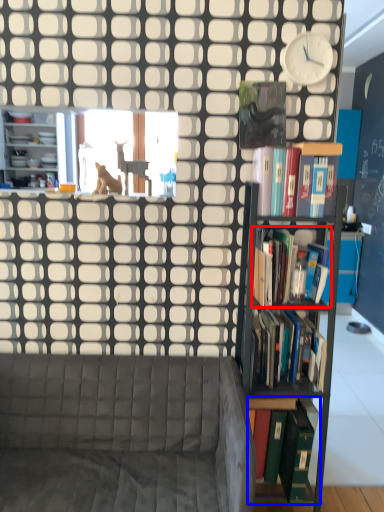
Question: Among these objects, which one is farthest to the camera, book (highlighted by a red box) or book (highlighted by a blue box)?

Choices:
 (A) book
 (B) book

Answer: (B)